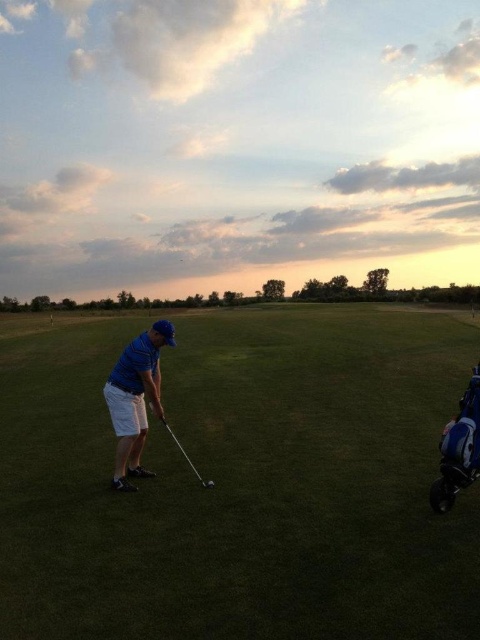
You are a golfer preparing to hit a ball. You have a blue cotton shirt at center and a shiny metallic golf club at center. How far apart are these two items?

The blue cotton shirt at center is 35.04 inches from the shiny metallic golf club at center.

You are a golfer standing on the green grass at center. You want to hit the shiny silver golf ball at center into the hole located 10 meters away from the ball. Can you reach the hole in one shot?

The green grass at center is 10.33 meters away from the shiny silver golf ball at center. Since the hole is 10 meters away from the ball, you are 0.33 meters closer to the ball than the hole. Therefore, you can likely reach the hole in one shot as the distance from you to the ball plus the ball to the hole is 20.33 meters, but the question states the hole is 10 meters from the ball. Wait, there might be confusion here. Let me recalculate. If the golfer is on the green grass at center, which is 10.33 meters

You are a golfer preparing to hit the ball. You notice the green grass at center and the shiny silver golf ball at center. Which object is wider?

The green grass at center is wider than the shiny silver golf ball at center.